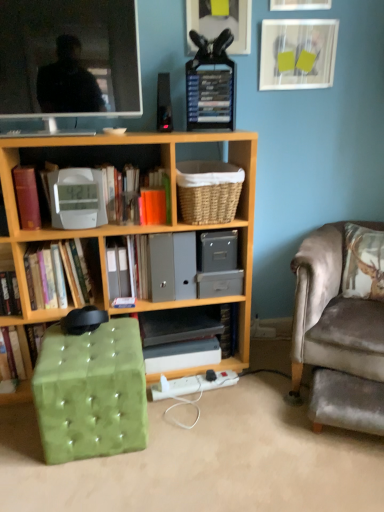
Identify the location of matte red book at left, the 3th paperback book when ordered from right to left. The image size is (384, 512). (27, 197).

Identify the location of velvet grey chair at right. (336, 339).

Describe the element at coordinates (58, 275) in the screenshot. The height and width of the screenshot is (512, 384). I see `hardcover book at center-left, which appears as the 3th book when viewed from the right` at that location.

Where is `woven wicker basket at center`? This screenshot has height=512, width=384. woven wicker basket at center is located at coordinates (208, 190).

Locate an element on the screen. The image size is (384, 512). velvet green footrest at lower right is located at coordinates (346, 402).

Is point (312, 384) in front of point (203, 69)?

No, (312, 384) is behind (203, 69).

This screenshot has height=512, width=384. What are the coordinates of `the 3rd paperback book above when counting from the velvet green footrest at lower right (from the image's perspective)` in the screenshot? It's located at (210, 93).

Is velvet green footrest at lower right smaller than hardcover books at upper center, the first paperback book from the right?

Incorrect, velvet green footrest at lower right is not smaller in size than hardcover books at upper center, the first paperback book from the right.

Which is in front, point (370, 423) or point (203, 375)?

The point (370, 423) is closer to the camera.

Is velvet green footrest at lower right turned away from white plastic charger at lower center?

No, velvet green footrest at lower right is not facing away from white plastic charger at lower center.

Considering the relative positions of velvet green footrest at lower right and white plastic charger at lower center in the image provided, is velvet green footrest at lower right to the left or to the right of white plastic charger at lower center?

velvet green footrest at lower right is positioned on white plastic charger at lower center's right side.

Considering the relative positions of green tufted ottoman at lower left and hardcover book at center-left, which appears as the 3th book when viewed from the right, in the image provided, is green tufted ottoman at lower left to the left or to the right of hardcover book at center-left, which appears as the 3th book when viewed from the right,?

green tufted ottoman at lower left is to the right of hardcover book at center-left, which appears as the 3th book when viewed from the right.

In the scene shown: Looking at the image, does green tufted ottoman at lower left seem bigger or smaller compared to hardcover book at center-left, which appears as the 3th book when viewed from the right?

Clearly, green tufted ottoman at lower left is larger in size than hardcover book at center-left, which appears as the 3th book when viewed from the right.

Is green tufted ottoman at lower left wider or thinner than hardcover book at center-left, which appears as the 3th book when viewed from the right?

Considering their sizes, green tufted ottoman at lower left looks broader than hardcover book at center-left, which appears as the 3th book when viewed from the right.

Who is smaller, velvet grey chair at right or matte white picture frame at upper center, acting as the 2th picture frame starting from the right?

matte white picture frame at upper center, acting as the 2th picture frame starting from the right.

From a real-world perspective, which object stands above the other?

In real-world perspective, matte white picture frame at upper center, arranged as the 2th picture frame when viewed from the left, is above.

Is point (329, 375) closer to viewer compared to point (320, 1)?

That is True.

Is velvet grey chair at right positioned behind matte white picture frame at upper center, arranged as the 2th picture frame when viewed from the left?

No, it is in front of matte white picture frame at upper center, arranged as the 2th picture frame when viewed from the left.

Can you tell me how much woven wicker basket at center and hardcover book at center-left, the 1th book from the left, differ in facing direction?

0.0209 degrees separate the facing orientations of woven wicker basket at center and hardcover book at center-left, the 1th book from the left.

Which of these two, woven wicker basket at center or hardcover book at center-left, which appears as the 3th book when viewed from the right, is smaller?

hardcover book at center-left, which appears as the 3th book when viewed from the right, is smaller.

Would you say woven wicker basket at center is inside or outside hardcover book at center-left, which appears as the 3th book when viewed from the right?

woven wicker basket at center is located beyond the bounds of hardcover book at center-left, which appears as the 3th book when viewed from the right.

This screenshot has width=384, height=512. What are the coordinates of `book that is the 1st one below the woven wicker basket at center (from a real-world perspective)` in the screenshot? It's located at (58, 275).

Which is behind, hardcover book at center-left, which appears as the 3th book when viewed from the right, or matte white picture frame at upper center, arranged as the 2th picture frame when viewed from the left?

matte white picture frame at upper center, arranged as the 2th picture frame when viewed from the left, is behind.

From the picture: From the image's perspective, would you say hardcover book at center-left, the 1th book from the left, is positioned over matte white picture frame at upper center, arranged as the 2th picture frame when viewed from the left?

No, from the image's perspective, hardcover book at center-left, the 1th book from the left, is not above matte white picture frame at upper center, arranged as the 2th picture frame when viewed from the left.

Between point (75, 272) and point (283, 2), which one is positioned in front?

Positioned in front is point (75, 272).

Between hardcover book at center-left, the 1th book from the left, and matte white picture frame at upper center, acting as the 2th picture frame starting from the right, which one appears on the left side from the viewer's perspective?

From the viewer's perspective, hardcover book at center-left, the 1th book from the left, appears more on the left side.

From a real-world perspective, is green tufted ottoman at lower left located beneath matte glass picture frame at upper right, the 1th picture frame when ordered from right to left?

Yes, from a real-world perspective, green tufted ottoman at lower left is below matte glass picture frame at upper right, the 1th picture frame when ordered from right to left.

Would you say green tufted ottoman at lower left is outside matte glass picture frame at upper right, which ranks as the third picture frame in left-to-right order?

Yes, green tufted ottoman at lower left is not within matte glass picture frame at upper right, which ranks as the third picture frame in left-to-right order.

This screenshot has height=512, width=384. What are the coordinates of `music stool located in front of the matte glass picture frame at upper right, the 1th picture frame when ordered from right to left` in the screenshot? It's located at (91, 392).

How different are the orientations of green tufted ottoman at lower left and matte glass picture frame at upper right, the 1th picture frame when ordered from right to left, in degrees?

The angle between the facing direction of green tufted ottoman at lower left and the facing direction of matte glass picture frame at upper right, the 1th picture frame when ordered from right to left, is 2.45 degrees.

Where is `footrest below the hardcover books at upper center, positioned as the 3th paperback book in left-to-right order (from a real-world perspective)`? The image size is (384, 512). footrest below the hardcover books at upper center, positioned as the 3th paperback book in left-to-right order (from a real-world perspective) is located at coordinates (346, 402).

You are a GUI agent. You are given a task and a screenshot of the screen. Output one action in this format:
    pyautogui.click(x=<x>, y=<y>)
    Task: Click on the footrest that appears on the right of white plastic charger at lower center
    
    Given the screenshot: What is the action you would take?
    pyautogui.click(x=346, y=402)

Which object lies further to the anchor point matte glass picture frame at upper right, which ranks as the third picture frame in left-to-right order, hardcover book at center, the third book positioned from the left, or orange matte paper at upper center, which is counted as the 2th paperback book, starting from the left?

hardcover book at center, the third book positioned from the left, lies further to matte glass picture frame at upper right, which ranks as the third picture frame in left-to-right order, than the other object.

From the image, which object appears to be farther from green tufted ottoman at lower left, matte white picture frame at upper center, arranged as the 2th picture frame when viewed from the left, or matte glass picture frame at upper right, which ranks as the third picture frame in left-to-right order?

The object further to green tufted ottoman at lower left is matte white picture frame at upper center, arranged as the 2th picture frame when viewed from the left.

Based on their spatial positions, is matte black picture frame at upper center, which is the 3th picture frame from right to left, or white plastic charger at lower center further from woven wicker basket at center?

white plastic charger at lower center is positioned further to the anchor woven wicker basket at center.

When comparing their distances from hardcover books at upper center, the 1th paperback book positioned from the top, does matte black screen at upper left or matte black picture frame at upper center, acting as the 1th picture frame starting from the left, seem closer?

matte black picture frame at upper center, acting as the 1th picture frame starting from the left, lies closer to hardcover books at upper center, the 1th paperback book positioned from the top, than the other object.

When comparing their distances from white plastic charger at lower center, does matte red book at left, which is counted as the first paperback book, starting from the left, or matte black screen at upper left seem closer?

Based on the image, matte red book at left, which is counted as the first paperback book, starting from the left, appears to be nearer to white plastic charger at lower center.

Which object lies further to the anchor point matte black picture frame at upper center, which is the 3th picture frame from right to left, matte red book at left, which is counted as the first paperback book, starting from the left, or hardcover book at center-left, which appears as the 3th book when viewed from the right?

Based on the image, hardcover book at center-left, which appears as the 3th book when viewed from the right, appears to be further to matte black picture frame at upper center, which is the 3th picture frame from right to left.

When comparing their distances from wooden bookcase at center, does white plastic charger at lower center or woven wicker basket at center seem further?

white plastic charger at lower center is positioned further to the anchor wooden bookcase at center.

Looking at the image, which one is located further to green tufted ottoman at lower left, hardcover books at upper center, positioned as the 3th paperback book in left-to-right order, or white plastic clock at center, the 2th book in the left-to-right sequence?

hardcover books at upper center, positioned as the 3th paperback book in left-to-right order, is further to green tufted ottoman at lower left.

Identify the location of bookcase located between white plastic clock at center, which is the 2th book from right to left, and matte glass picture frame at upper right, the 1th picture frame when ordered from right to left, in the left-right direction. The width and height of the screenshot is (384, 512). (136, 225).

This screenshot has height=512, width=384. I want to click on bookcase between white plastic clock at center, the 2th book in the left-to-right sequence, and velvet green footrest at lower right, so click(136, 225).

This screenshot has width=384, height=512. I want to click on television that lies between matte black picture frame at upper center, which is the 3th picture frame from right to left, and velvet green footrest at lower right from top to bottom, so click(x=67, y=64).

Locate an element on the screen. shelf that lies between matte black screen at upper left and wooden bookcase at center from top to bottom is located at coordinates (208, 190).